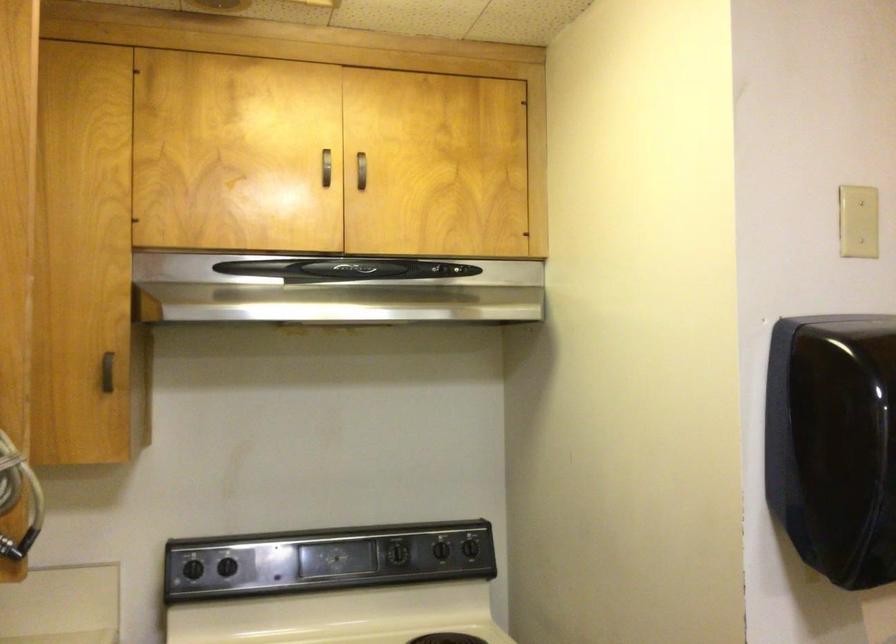
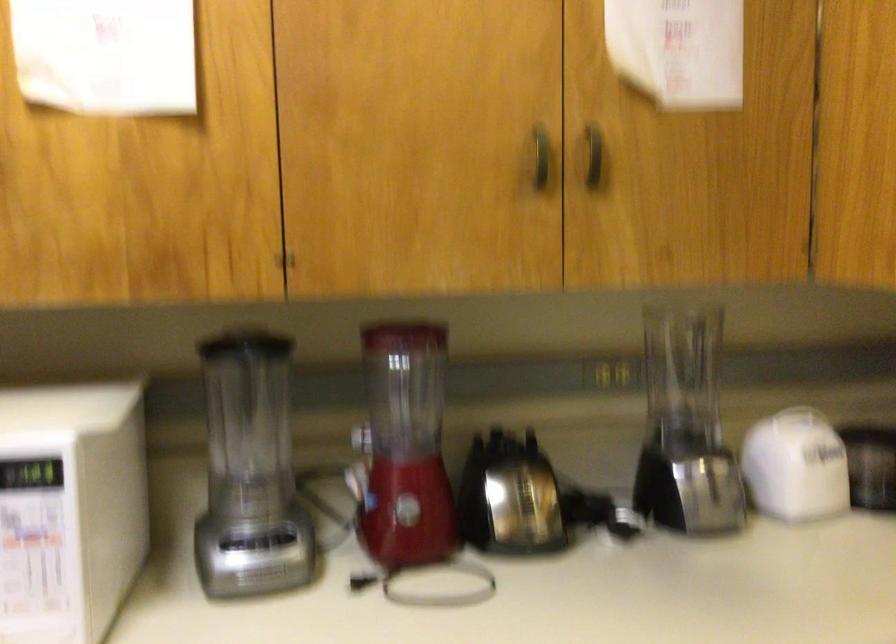
Question: How did the camera likely rotate?

Choices:
 (A) Left
 (B) Right
 (C) Up
 (D) Down

Answer: (A)